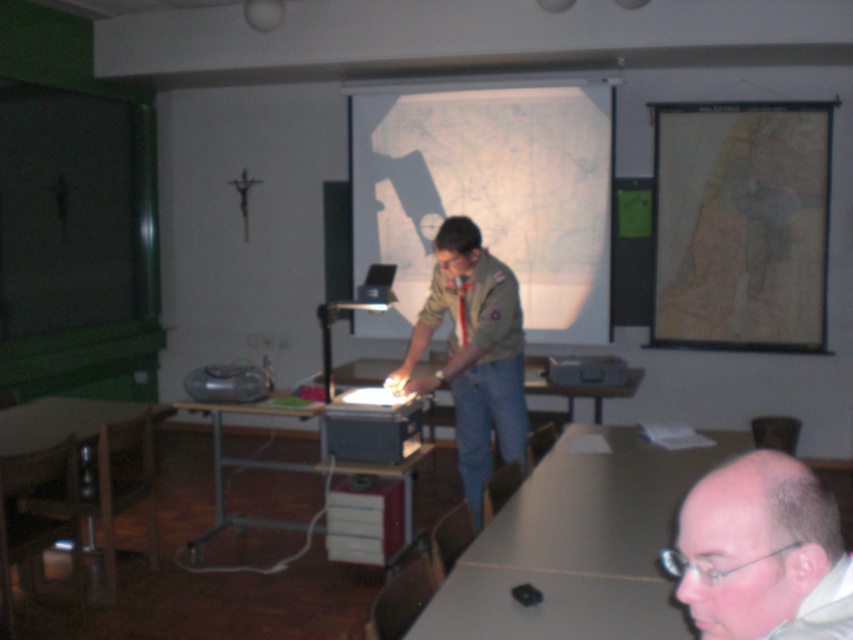
Question: Among these points, which one is farthest from the camera?

Choices:
 (A) (376, 365)
 (B) (466, 374)

Answer: (A)

Question: Is green uniform at center above wooden table at lower left?

Choices:
 (A) no
 (B) yes

Answer: (B)

Question: Is smooth beige table at lower center to the right of bald head at lower right from the viewer's perspective?

Choices:
 (A) yes
 (B) no

Answer: (A)

Question: Does map paper at upper right appear under wooden table at lower left?

Choices:
 (A) no
 (B) yes

Answer: (A)

Question: Which is nearer to the matte black projector at center?

Choices:
 (A) smooth beige table at lower center
 (B) green uniform at center
 (C) wooden table at lower left

Answer: (C)

Question: Among these points, which one is nearest to the camera?

Choices:
 (A) (813, 500)
 (B) (1, 429)
 (C) (190, 554)

Answer: (A)